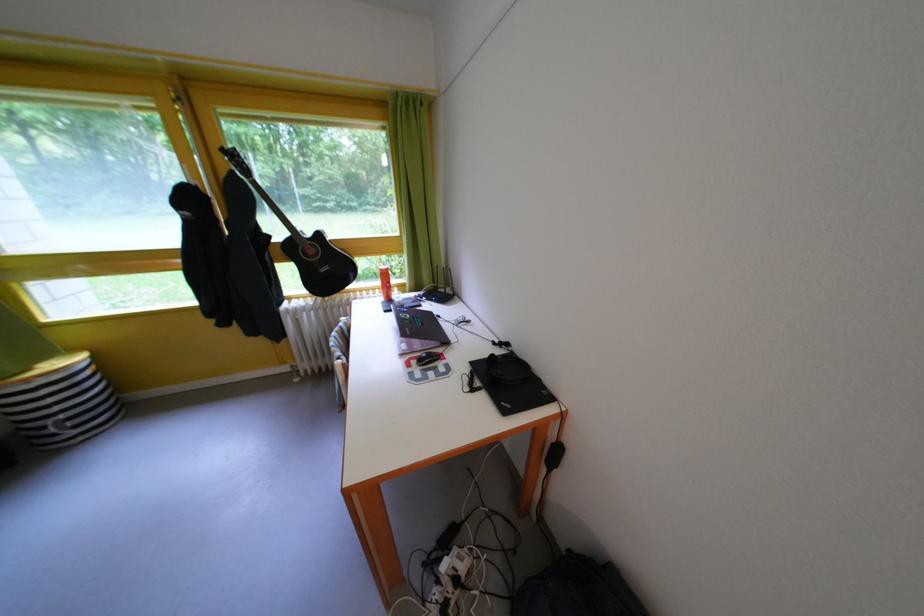
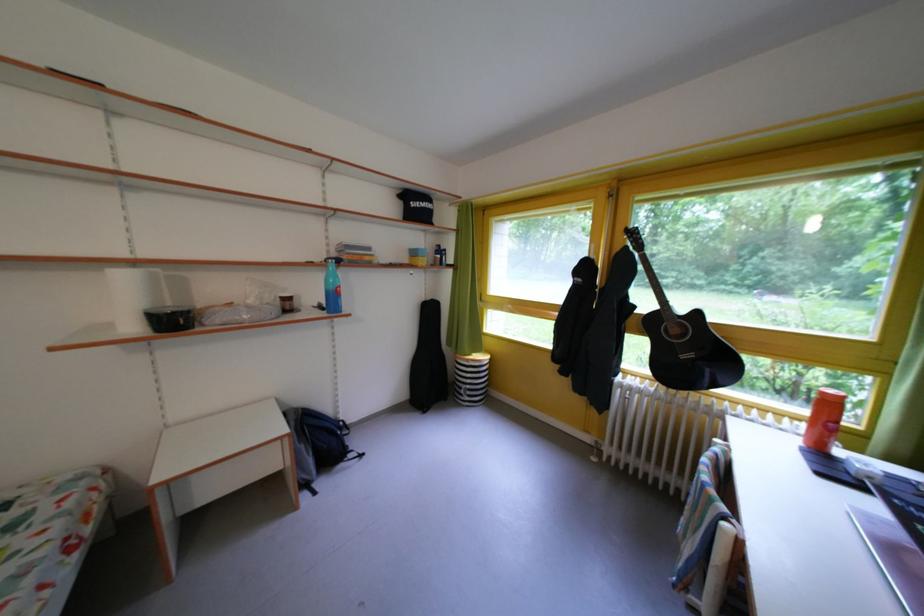
In the second image, find the point that corresponds to point 202,188 in the first image.

(602, 262)